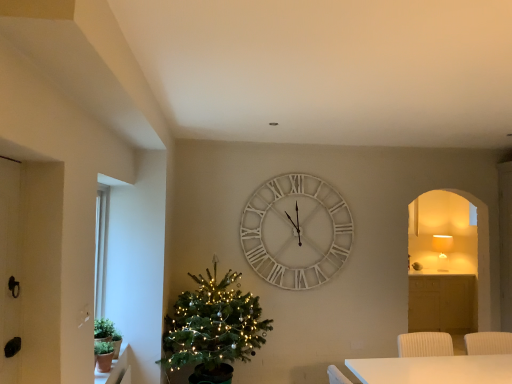
Question: Does matte white lampshade at right have a greater height compared to terracotta clay pot at lower left?

Choices:
 (A) yes
 (B) no

Answer: (A)

Question: Considering the relative sizes of matte white lampshade at right and terracotta clay pot at lower left in the image provided, is matte white lampshade at right smaller than terracotta clay pot at lower left?

Choices:
 (A) yes
 (B) no

Answer: (B)

Question: Is matte white lampshade at right bigger than terracotta clay pot at lower left?

Choices:
 (A) yes
 (B) no

Answer: (A)

Question: Is the depth of matte white lampshade at right less than that of terracotta clay pot at lower left?

Choices:
 (A) yes
 (B) no

Answer: (B)

Question: Is matte white lampshade at right behind terracotta clay pot at lower left?

Choices:
 (A) no
 (B) yes

Answer: (B)

Question: Is matte white lampshade at right not close to terracotta clay pot at lower left?

Choices:
 (A) no
 (B) yes

Answer: (B)

Question: Is black matte glass door at left at the back of green matte christmas tree at left?

Choices:
 (A) yes
 (B) no

Answer: (B)

Question: Considering the relative sizes of green matte christmas tree at left and black matte glass door at left in the image provided, is green matte christmas tree at left shorter than black matte glass door at left?

Choices:
 (A) no
 (B) yes

Answer: (A)

Question: Is green matte christmas tree at left bigger than black matte glass door at left?

Choices:
 (A) no
 (B) yes

Answer: (B)

Question: Does green matte christmas tree at left lie behind black matte glass door at left?

Choices:
 (A) no
 (B) yes

Answer: (B)

Question: Does green matte christmas tree at left have a greater width compared to black matte glass door at left?

Choices:
 (A) no
 (B) yes

Answer: (B)

Question: Are green matte christmas tree at left and black matte glass door at left located far from each other?

Choices:
 (A) no
 (B) yes

Answer: (B)

Question: Does terracotta clay pot at lower left have a lesser width compared to green matte christmas tree at left?

Choices:
 (A) no
 (B) yes

Answer: (B)